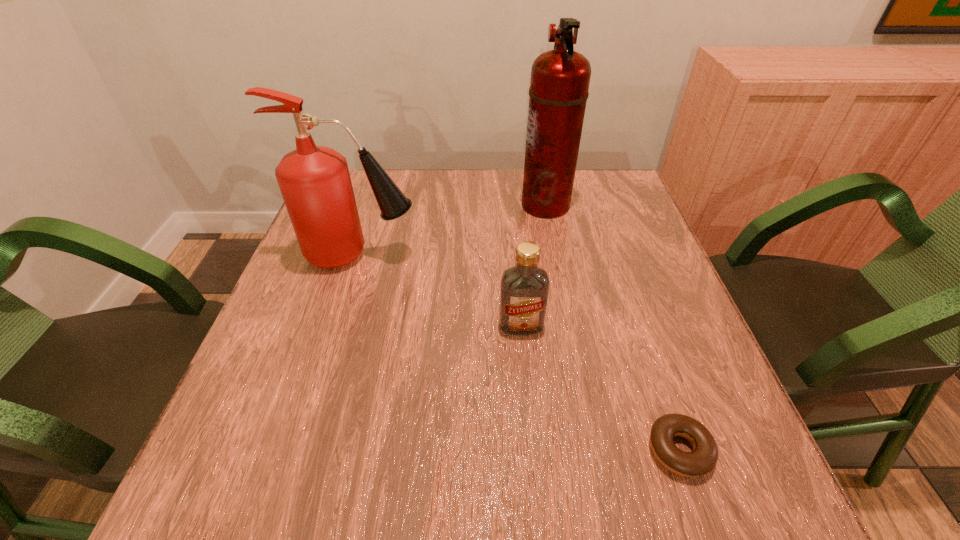
Find the location of a particular element. Image resolution: width=960 pixels, height=540 pixels. vacant space located on the nozzle side of the right fire extinguisher is located at coordinates (480, 205).

Identify the location of free space located with the nozzle aimed from the nearer fire extinguisher. (447, 255).

Image resolution: width=960 pixels, height=540 pixels. I want to click on blank area located on the front-facing side of the third farthest object, so click(x=529, y=415).

Find the location of a particular element. free space located 0.320m on the left of the doughnut is located at coordinates (446, 450).

At what (x,y) coordinates should I click in order to perform the action: click on object that is at the far edge. Please return your answer as a coordinate pair (x, y). The width and height of the screenshot is (960, 540). Looking at the image, I should click on (560, 78).

You are a GUI agent. You are given a task and a screenshot of the screen. Output one action in this format:
    pyautogui.click(x=<x>, y=<y>)
    Task: Click on the object that is positioned at the near edge
    The height and width of the screenshot is (540, 960).
    Given the screenshot: What is the action you would take?
    pyautogui.click(x=703, y=458)

At what (x,y) coordinates should I click in order to perform the action: click on object that is at the left edge. Please return your answer as a coordinate pair (x, y). This screenshot has width=960, height=540. Looking at the image, I should click on (315, 183).

I want to click on object present at the right edge, so click(703, 458).

Identify the location of object that is at the near right corner. Image resolution: width=960 pixels, height=540 pixels. (703, 458).

Locate an element on the screen. The height and width of the screenshot is (540, 960). free spot at the far edge of the desktop is located at coordinates (497, 213).